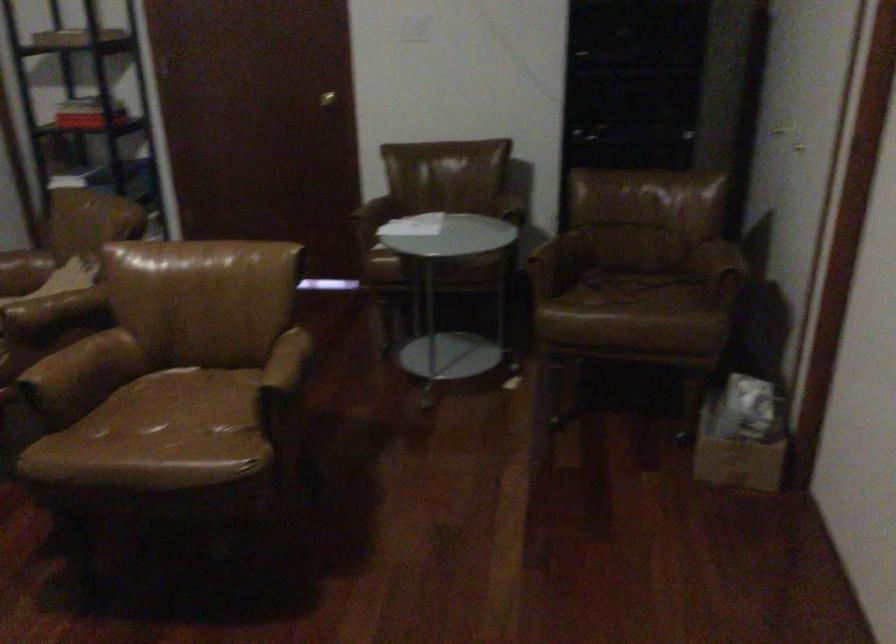
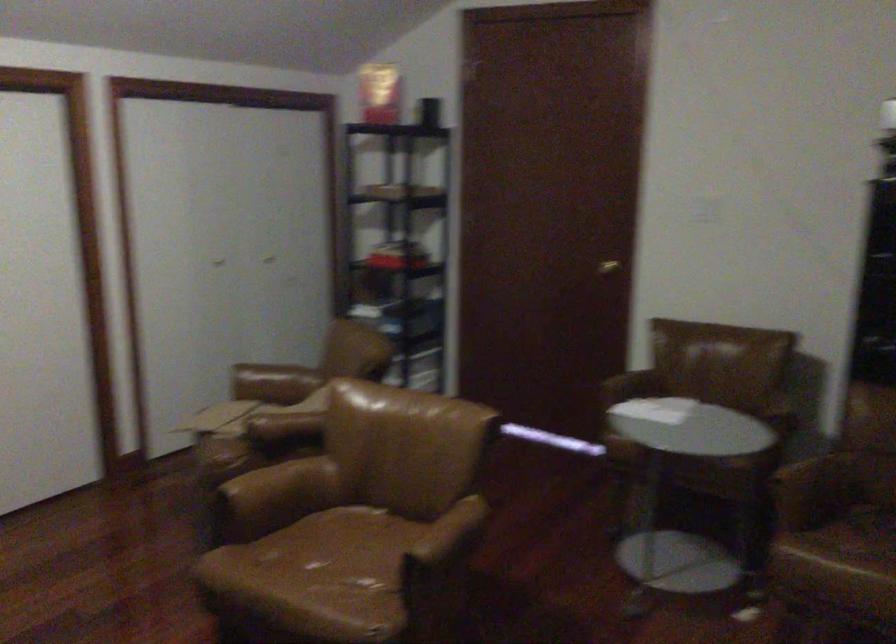
Locate, in the second image, the point that corresponds to (177,409) in the first image.

(343, 556)